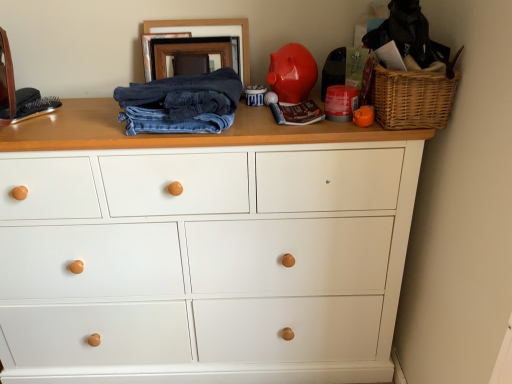
Question: Is dark blue denim jeans at center directly adjacent to white matte chest of drawers at center?

Choices:
 (A) no
 (B) yes

Answer: (A)

Question: From a real-world perspective, is dark blue denim jeans at center located beneath white matte chest of drawers at center?

Choices:
 (A) no
 (B) yes

Answer: (A)

Question: From the image's perspective, is dark blue denim jeans at center located beneath white matte chest of drawers at center?

Choices:
 (A) no
 (B) yes

Answer: (A)

Question: Considering the relative sizes of dark blue denim jeans at center and white matte chest of drawers at center in the image provided, is dark blue denim jeans at center bigger than white matte chest of drawers at center?

Choices:
 (A) yes
 (B) no

Answer: (B)

Question: From the image's perspective, would you say dark blue denim jeans at center is positioned over white matte chest of drawers at center?

Choices:
 (A) no
 (B) yes

Answer: (B)

Question: Which is correct: woven brown basket at upper right is inside white matte chest of drawers at center, or outside of it?

Choices:
 (A) outside
 (B) inside

Answer: (A)

Question: In terms of height, does woven brown basket at upper right look taller or shorter compared to white matte chest of drawers at center?

Choices:
 (A) short
 (B) tall

Answer: (A)

Question: Considering their positions, is woven brown basket at upper right located in front of or behind white matte chest of drawers at center?

Choices:
 (A) behind
 (B) front

Answer: (B)

Question: Looking at the image, does woven brown basket at upper right seem bigger or smaller compared to white matte chest of drawers at center?

Choices:
 (A) small
 (B) big

Answer: (A)

Question: Is dark blue denim jeans at center taller or shorter than woven brown basket at upper right?

Choices:
 (A) short
 (B) tall

Answer: (A)

Question: In terms of size, does dark blue denim jeans at center appear bigger or smaller than woven brown basket at upper right?

Choices:
 (A) small
 (B) big

Answer: (B)

Question: From the image's perspective, relative to woven brown basket at upper right, is dark blue denim jeans at center above or below?

Choices:
 (A) below
 (B) above

Answer: (A)

Question: Looking at their shapes, would you say dark blue denim jeans at center is wider or thinner than woven brown basket at upper right?

Choices:
 (A) wide
 (B) thin

Answer: (A)

Question: In the image, is glossy ceramic piggy bank at upper center positioned in front of or behind white matte chest of drawers at center?

Choices:
 (A) front
 (B) behind

Answer: (B)

Question: Looking at the image, does glossy ceramic piggy bank at upper center seem bigger or smaller compared to white matte chest of drawers at center?

Choices:
 (A) small
 (B) big

Answer: (A)